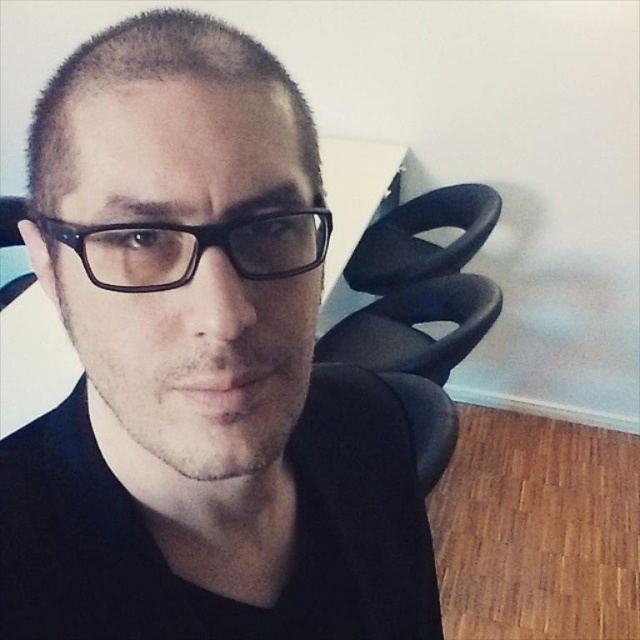
Between matte black glasses at center and black plastic glasses at center, which one is positioned higher?

black plastic glasses at center

Between matte black glasses at center and black plastic glasses at center, which one has less height?

black plastic glasses at center is shorter.

Who is more distant from viewer, [221,280] or [312,244]?

Point [312,244]

You are a GUI agent. You are given a task and a screenshot of the screen. Output one action in this format:
    pyautogui.click(x=<x>, y=<y>)
    Task: Click on the matte black glasses at center
    
    Given the screenshot: What is the action you would take?
    pyautogui.click(x=198, y=369)